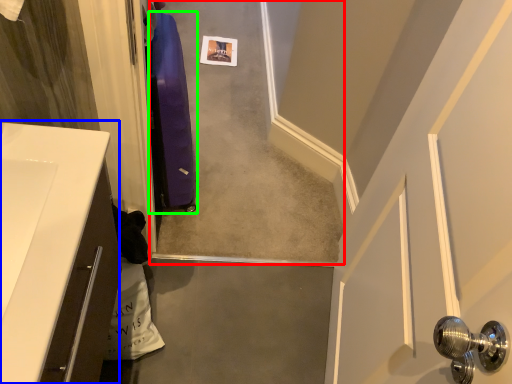
Question: Which object is the farthest from concrete (highlighted by a red box)? Choose among these: counter top (highlighted by a blue box) or luggage (highlighted by a green box).

Choices:
 (A) counter top
 (B) luggage

Answer: (A)